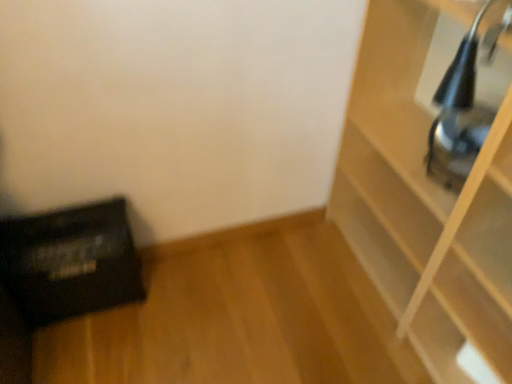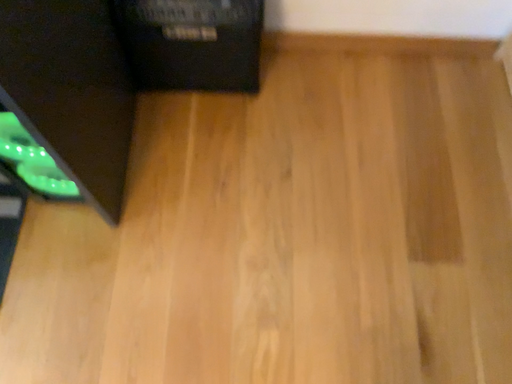
Question: How did the camera likely rotate when shooting the video?

Choices:
 (A) rotated upward
 (B) rotated downward

Answer: (B)